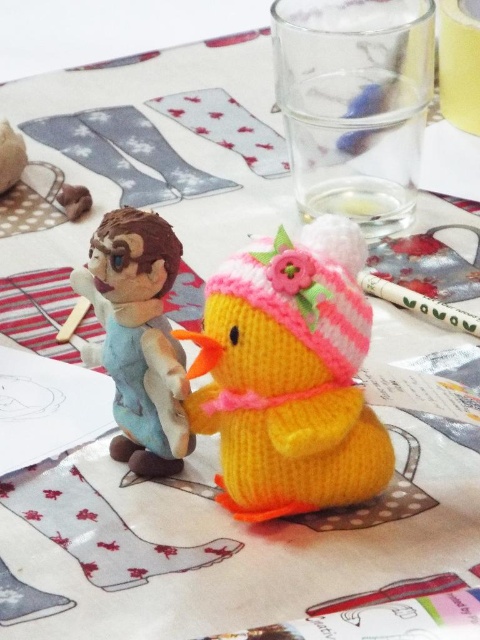
Describe the element at coordinates (289, 376) in the screenshot. Image resolution: width=480 pixels, height=640 pixels. I see `knitted yellow duckling at center` at that location.

Which is in front, point (228, 429) or point (112, 449)?

Point (228, 429) is in front.

What do you see at coordinates (289, 376) in the screenshot? Image resolution: width=480 pixels, height=640 pixels. I see `knitted yellow duckling at center` at bounding box center [289, 376].

Find the location of a particular element. This screenshot has height=640, width=480. knitted yellow duckling at center is located at coordinates (289, 376).